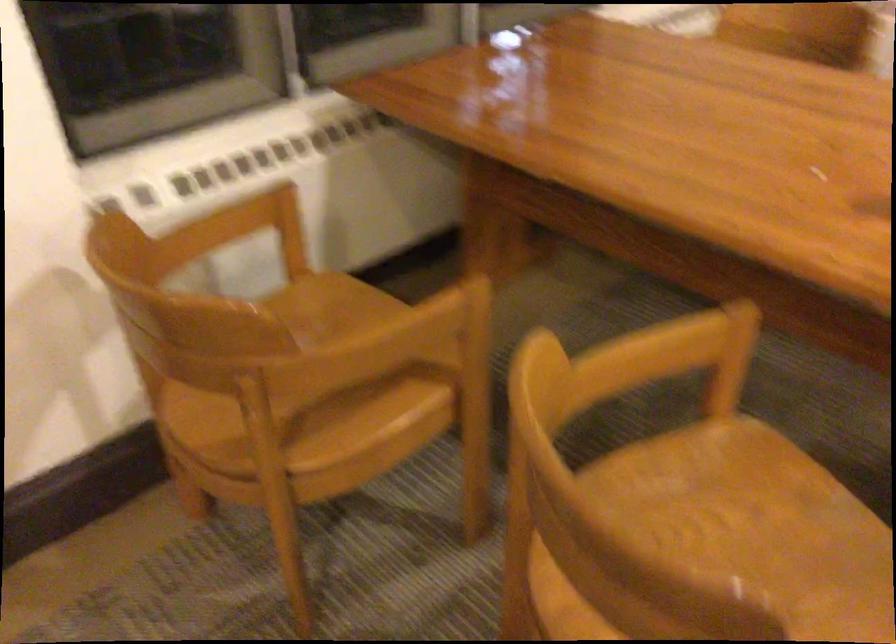
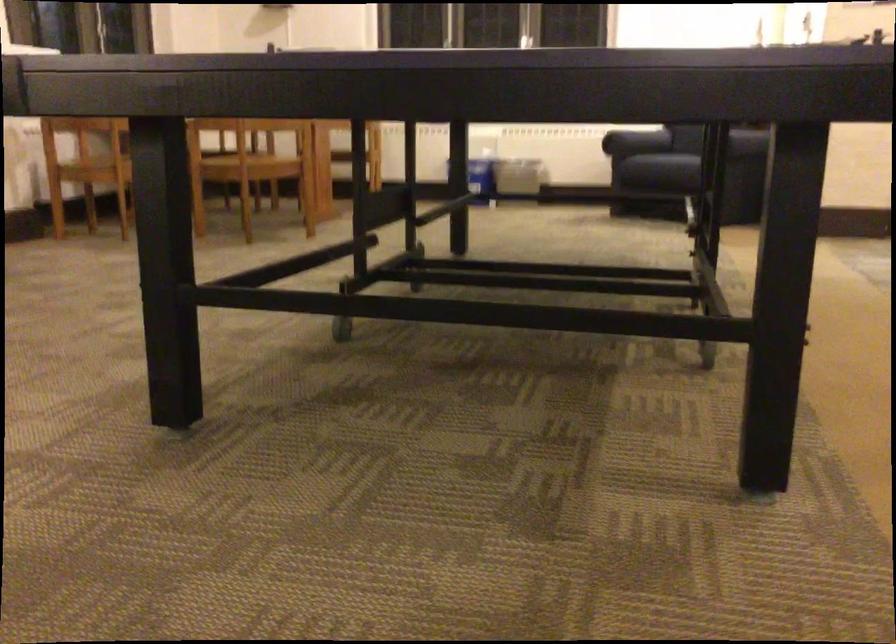
The point at (202,447) is marked in the first image. Where is the corresponding point in the second image?

(95, 169)